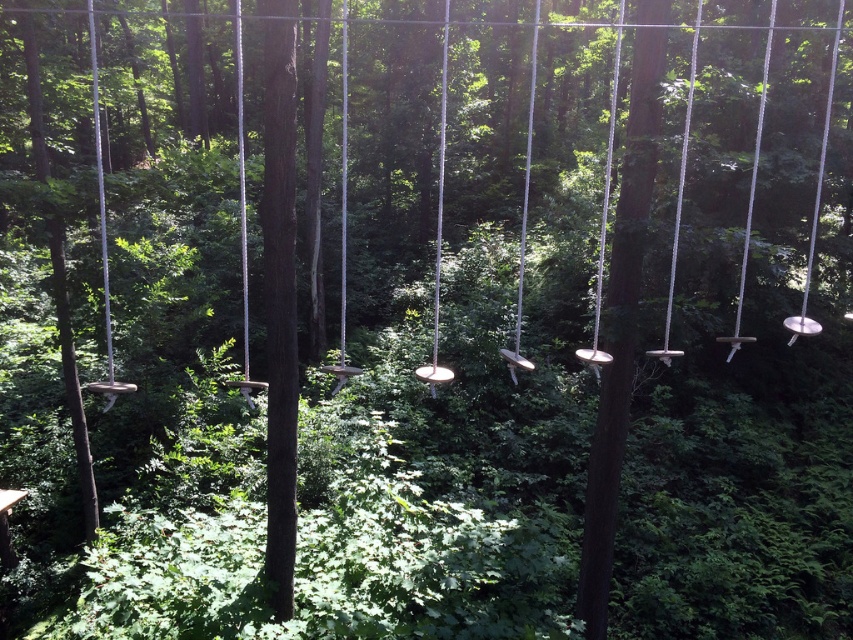
Is metallic silver swing at left shorter than metallic silver swing at center?

Yes, metallic silver swing at left is shorter than metallic silver swing at center.

Who is more distant from viewer, (x=106, y=250) or (x=419, y=372)?

Positioned behind is point (x=106, y=250).

Locate an element on the screen. Image resolution: width=853 pixels, height=640 pixels. metallic silver swing at left is located at coordinates (102, 234).